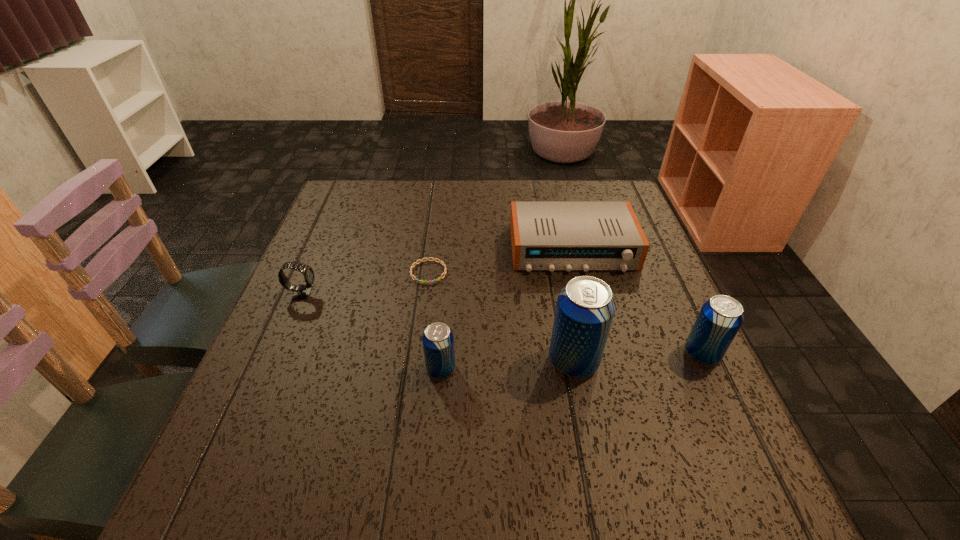
All beer cans are currently evenly spaced. To continue this pattern, where would you add another beer can on the left? Please point out a vacant spot. Please provide its 2D coordinates. Your answer should be formatted as a tuple, i.e. [(x, y)], where the tuple contains the x and y coordinates of a point satisfying the conditions above.

[(303, 377)]